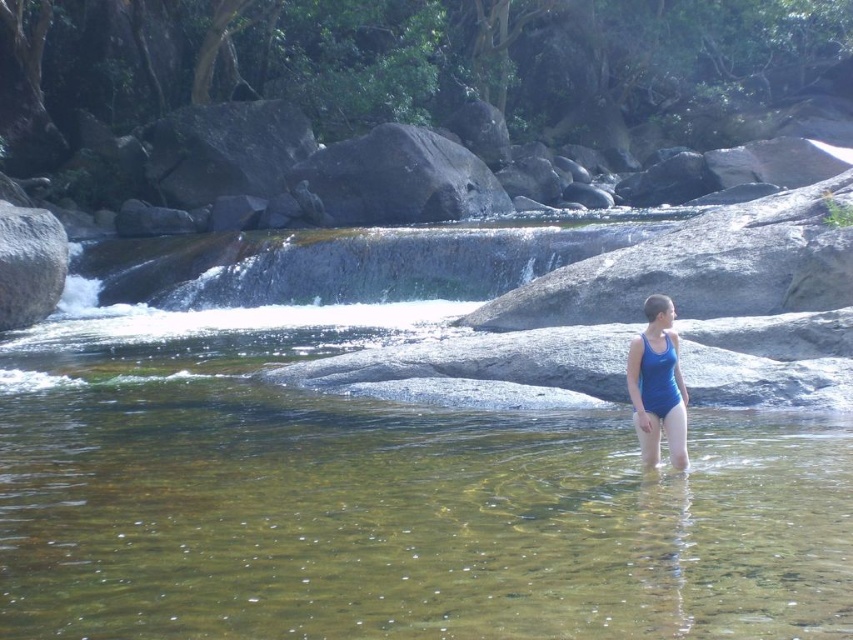
Question: Among these points, which one is farthest from the camera?

Choices:
 (A) (651, 460)
 (B) (355, 148)
 (C) (7, 300)

Answer: (B)

Question: Is the position of gray rough rock at center more distant than that of blue fabric swimsuit at center?

Choices:
 (A) yes
 (B) no

Answer: (A)

Question: Does blue fabric swimsuit at center appear over gray smooth rock at left?

Choices:
 (A) no
 (B) yes

Answer: (A)

Question: Which point is farther from the camera taking this photo?

Choices:
 (A) (509, 198)
 (B) (28, 224)
 (C) (675, 392)

Answer: (A)

Question: Which of the following is the closest to the observer?

Choices:
 (A) blue fabric swimsuit at center
 (B) gray smooth rock at left

Answer: (A)

Question: Considering the relative positions of blue fabric swimsuit at center and gray smooth rock at left in the image provided, where is blue fabric swimsuit at center located with respect to gray smooth rock at left?

Choices:
 (A) below
 (B) above

Answer: (A)